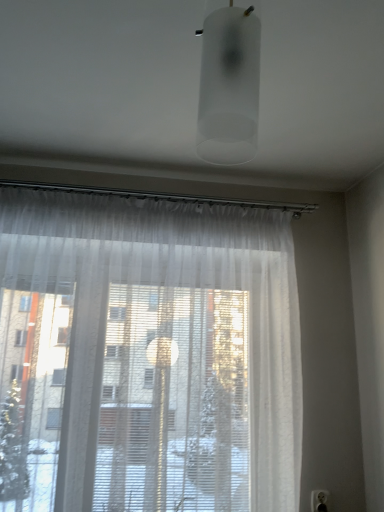
What is the approximate height of white plastic electric outlet at lower right?

white plastic electric outlet at lower right is 11.45 centimeters tall.

What do you see at coordinates (148, 354) in the screenshot? I see `sheer white curtain at center` at bounding box center [148, 354].

You are a GUI agent. You are given a task and a screenshot of the screen. Output one action in this format:
    pyautogui.click(x=<x>, y=<y>)
    Task: Click on the frosted glass cylinder at upper center
    
    Given the screenshot: What is the action you would take?
    pyautogui.click(x=229, y=86)

Choose the correct answer: Is white plastic electric outlet at lower right inside sheer white curtain at center or outside it?

white plastic electric outlet at lower right lies outside sheer white curtain at center.

Where is `electric outlet that is behind the sheer white curtain at center`? This screenshot has height=512, width=384. electric outlet that is behind the sheer white curtain at center is located at coordinates (319, 501).

Does white plastic electric outlet at lower right lie behind sheer white curtain at center?

Yes, it is.

Considering the points (243, 153) and (96, 352), which point is in front, point (243, 153) or point (96, 352)?

The point (96, 352) is more forward.

Consider the image. Is frosted glass cylinder at upper center far away from sheer white curtain at center?

frosted glass cylinder at upper center is actually quite close to sheer white curtain at center.

Does sheer white curtain at center turn towards frosted glass cylinder at upper center?

Yes, sheer white curtain at center faces towards frosted glass cylinder at upper center.

Which of these two, sheer white curtain at center or frosted glass cylinder at upper center, is thinner?

frosted glass cylinder at upper center is thinner.

Based on the photo, from the image's perspective, which is above, sheer white curtain at center or frosted glass cylinder at upper center?

frosted glass cylinder at upper center appears higher in the image.

Could you tell me if sheer white curtain at center is turned towards white plastic electric outlet at lower right?

No, sheer white curtain at center is not aimed at white plastic electric outlet at lower right.

Is the depth of sheer white curtain at center greater than that of white plastic electric outlet at lower right?

No, sheer white curtain at center is in front of white plastic electric outlet at lower right.

Which object is wider, sheer white curtain at center or white plastic electric outlet at lower right?

With larger width is sheer white curtain at center.

From a real-world perspective, which object stands above the other?

In real-world perspective, frosted glass cylinder at upper center is above.

Considering the sizes of frosted glass cylinder at upper center and white plastic electric outlet at lower right in the image, is frosted glass cylinder at upper center taller or shorter than white plastic electric outlet at lower right?

Clearly, frosted glass cylinder at upper center is taller compared to white plastic electric outlet at lower right.

Considering the relative sizes of frosted glass cylinder at upper center and white plastic electric outlet at lower right in the image provided, is frosted glass cylinder at upper center wider than white plastic electric outlet at lower right?

Yes.

From the image's perspective, is frosted glass cylinder at upper center positioned above or below white plastic electric outlet at lower right?

Clearly, from the image's perspective, frosted glass cylinder at upper center is above white plastic electric outlet at lower right.

Is white plastic electric outlet at lower right not near frosted glass cylinder at upper center?

Yes, white plastic electric outlet at lower right and frosted glass cylinder at upper center are located far from each other.

Does point (317, 501) come behind point (249, 55)?

Yes, it is.

From the image's perspective, which is above, white plastic electric outlet at lower right or frosted glass cylinder at upper center?

frosted glass cylinder at upper center, from the image's perspective.

Find the location of a particular element. This screenshot has height=512, width=384. curtain above the white plastic electric outlet at lower right (from the image's perspective) is located at coordinates (148, 354).

The width and height of the screenshot is (384, 512). What are the coordinates of `curtain that appears below the frosted glass cylinder at upper center (from a real-world perspective)` in the screenshot? It's located at (148, 354).

Considering their positions, is frosted glass cylinder at upper center positioned further to sheer white curtain at center than white plastic electric outlet at lower right?

Based on the image, white plastic electric outlet at lower right appears to be further to sheer white curtain at center.

When comparing their distances from sheer white curtain at center, does white plastic electric outlet at lower right or frosted glass cylinder at upper center seem further?

Based on the image, white plastic electric outlet at lower right appears to be further to sheer white curtain at center.

From the image, which object appears to be farther from white plastic electric outlet at lower right, sheer white curtain at center or frosted glass cylinder at upper center?

The object further to white plastic electric outlet at lower right is frosted glass cylinder at upper center.

Looking at the image, which one is located further to frosted glass cylinder at upper center, white plastic electric outlet at lower right or sheer white curtain at center?

Among the two, white plastic electric outlet at lower right is located further to frosted glass cylinder at upper center.

Considering their positions, is frosted glass cylinder at upper center positioned closer to white plastic electric outlet at lower right than sheer white curtain at center?

The object closer to white plastic electric outlet at lower right is sheer white curtain at center.

Which object lies nearer to the anchor point frosted glass cylinder at upper center, sheer white curtain at center or white plastic electric outlet at lower right?

The object closer to frosted glass cylinder at upper center is sheer white curtain at center.

Identify the location of curtain between frosted glass cylinder at upper center and white plastic electric outlet at lower right from top to bottom. The image size is (384, 512). (148, 354).